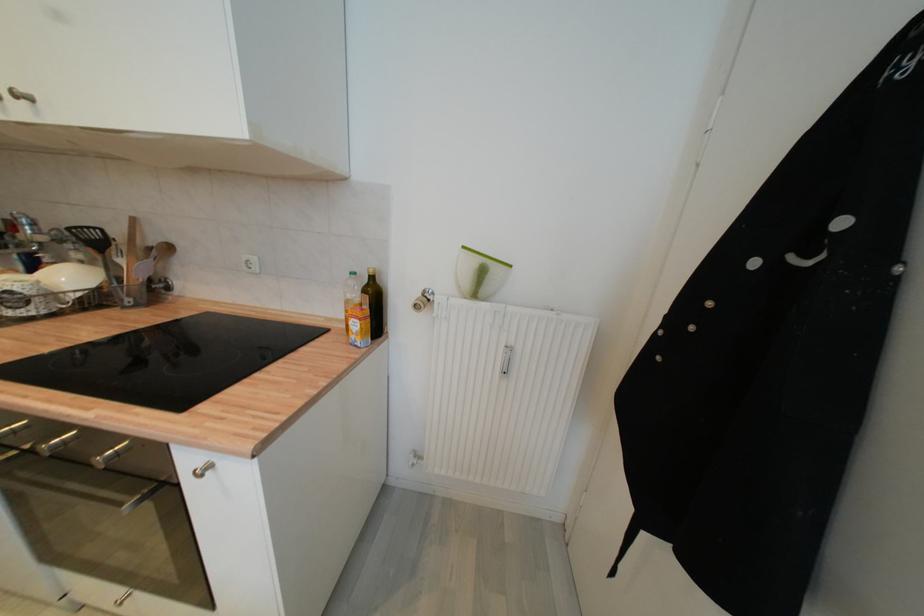
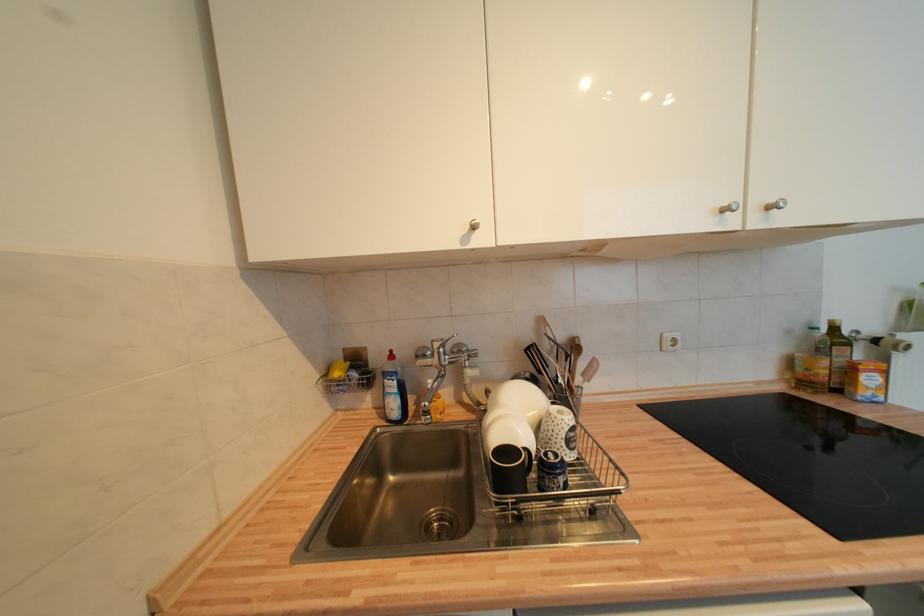
Locate, in the second image, the point that corresponds to point 359,334 in the first image.

(873, 391)